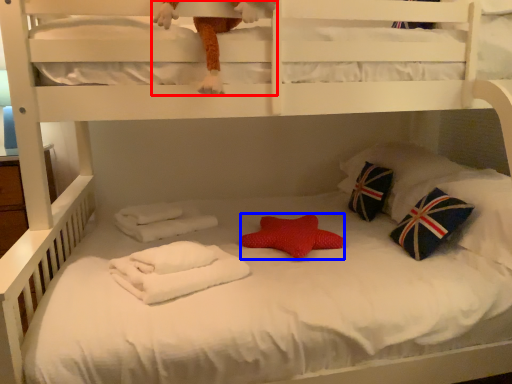
Question: Which object appears closest to the camera in this image, toy (highlighted by a red box) or throw pillow (highlighted by a blue box)?

Choices:
 (A) toy
 (B) throw pillow

Answer: (A)